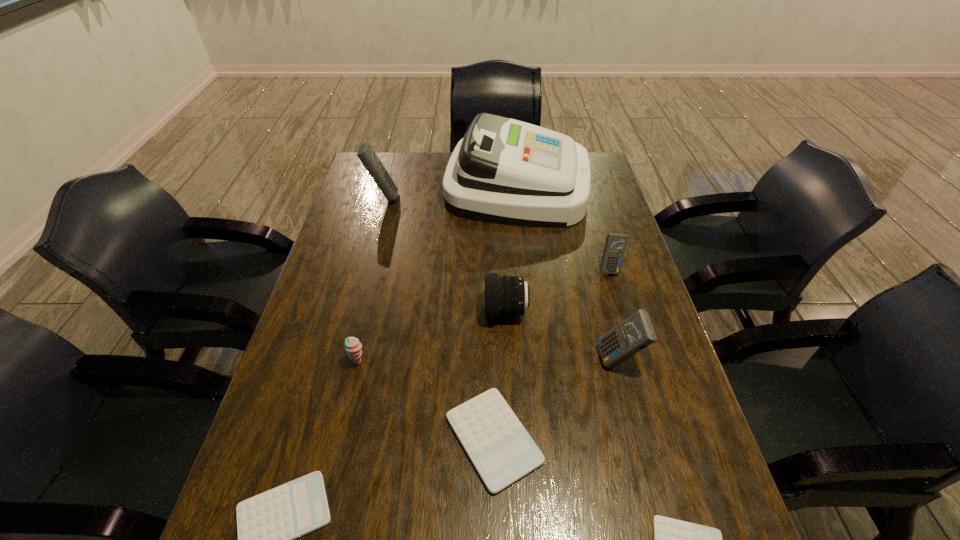
Find the location of a particular element. cash register is located at coordinates (504, 171).

This screenshot has height=540, width=960. Find the location of `the biggest blue calculator`. the biggest blue calculator is located at coordinates (366, 154).

The height and width of the screenshot is (540, 960). I want to click on the farthest calculator, so click(x=366, y=154).

The width and height of the screenshot is (960, 540). Find the location of `the seventh shortest object`. the seventh shortest object is located at coordinates (635, 333).

Where is `the second tallest calculator`? This screenshot has width=960, height=540. the second tallest calculator is located at coordinates (635, 333).

What are the coordinates of `the sixth nearest object` in the screenshot? It's located at (505, 296).

Where is `telephoto lens`? The width and height of the screenshot is (960, 540). telephoto lens is located at coordinates (505, 296).

At what (x,y) coordinates should I click in order to perform the action: click on the seventh nearest object. Please return your answer as a coordinate pair (x, y). This screenshot has width=960, height=540. Looking at the image, I should click on (615, 246).

Image resolution: width=960 pixels, height=540 pixels. What are the coordinates of `the fourth shortest calculator` in the screenshot? It's located at (615, 246).

At what (x,y) coordinates should I click in order to perform the action: click on the sixth tallest object. Please return your answer as a coordinate pair (x, y). Looking at the image, I should click on (353, 347).